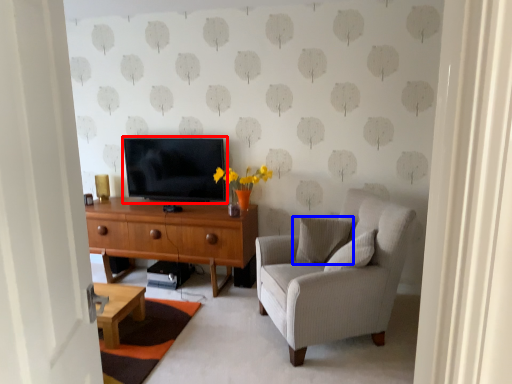
Question: Which object is further to the camera taking this photo, television (highlighted by a red box) or pillow (highlighted by a blue box)?

Choices:
 (A) television
 (B) pillow

Answer: (A)